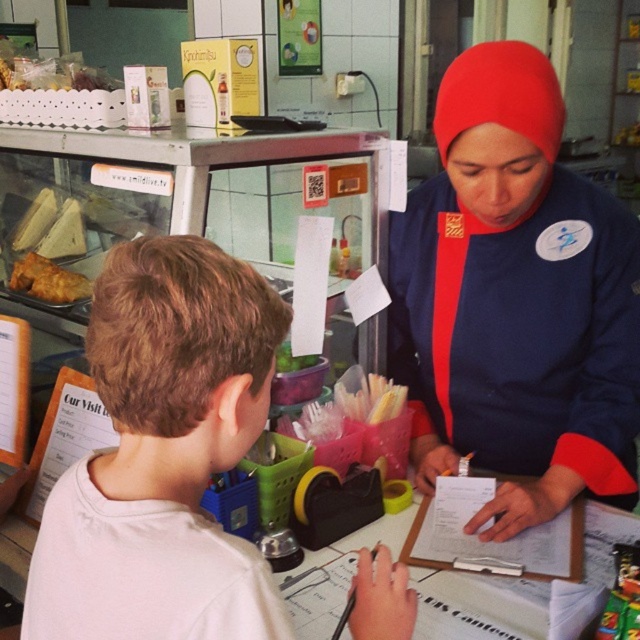
Question: Which object is closer to the camera taking this photo?

Choices:
 (A) blue fabric hijab at center
 (B) white matte shirt at center

Answer: (B)

Question: Observing the image, what is the correct spatial positioning of blue fabric hijab at center in reference to golden crispy pastry at left?

Choices:
 (A) below
 (B) above

Answer: (A)

Question: Which of the following is the farthest from the observer?

Choices:
 (A) white matte shirt at center
 (B) blue fabric hijab at center

Answer: (B)

Question: Where is blue fabric hijab at center located in relation to golden crispy pastry at left in the image?

Choices:
 (A) left
 (B) right

Answer: (B)

Question: Which point appears farthest from the camera in this image?

Choices:
 (A) (442, 324)
 (B) (33, 291)

Answer: (B)

Question: Is blue fabric hijab at center further to camera compared to white matte shirt at center?

Choices:
 (A) yes
 (B) no

Answer: (A)